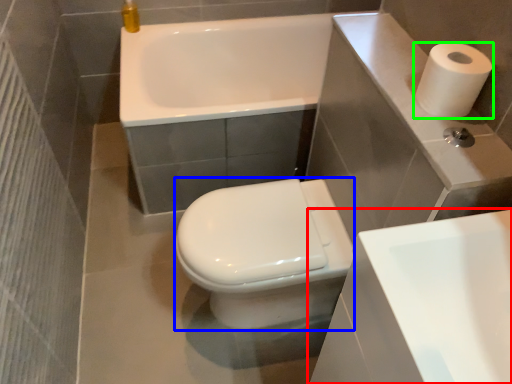
Question: Which is nearer to the sink (highlighted by a red box)? bidet (highlighted by a blue box) or paper towel (highlighted by a green box).

Choices:
 (A) bidet
 (B) paper towel

Answer: (B)